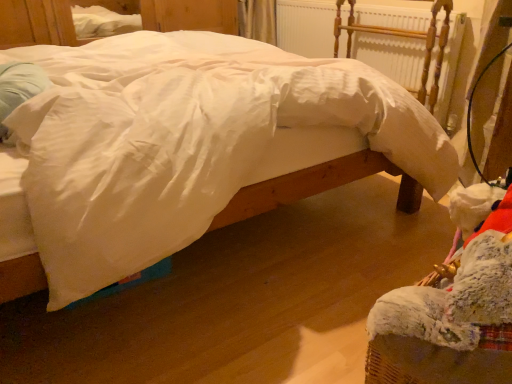
Where is `white painted wood radiator at upper center`? white painted wood radiator at upper center is located at coordinates (388, 41).

The height and width of the screenshot is (384, 512). I want to click on white smooth bed at center, so click(x=184, y=141).

Where is `white painted wood radiator at upper center`? white painted wood radiator at upper center is located at coordinates (388, 41).

At what (x,y) coordinates should I click in order to perform the action: click on radiator below the white smooth bed at center (from a real-world perspective). Please return your answer as a coordinate pair (x, y). Looking at the image, I should click on (388, 41).

Could you tell me if white smooth bed at center is facing white painted wood radiator at upper center?

Yes.

Considering the points (377, 91) and (370, 23), which point is in front, point (377, 91) or point (370, 23)?

The point (377, 91) is closer to the camera.

Does white smooth bed at center turn towards white soft pillow at left?

No, white smooth bed at center is not facing towards white soft pillow at left.

Is white smooth bed at center outside of white soft pillow at left?

Result: Indeed, white smooth bed at center is completely outside white soft pillow at left.

In the image, there is a white soft pillow at left. Identify the location of bed below it (from a real-world perspective). (184, 141).

Who is smaller, white smooth bed at center or white soft pillow at left?

Smaller between the two is white soft pillow at left.

From the image's perspective, is white soft pillow at left above or below white painted wood radiator at upper center?

From the image's perspective, white soft pillow at left appears below white painted wood radiator at upper center.

From a real-world perspective, does white soft pillow at left sit lower than white painted wood radiator at upper center?

No, from a real-world perspective, white soft pillow at left is not beneath white painted wood radiator at upper center.

Is white soft pillow at left facing away from white painted wood radiator at upper center?

No, white soft pillow at left is not facing the opposite direction of white painted wood radiator at upper center.

Is white painted wood radiator at upper center behind white smooth bed at center?

Yes, white painted wood radiator at upper center is further from the viewer.

Where is `radiator that is behind the white smooth bed at center`? Image resolution: width=512 pixels, height=384 pixels. radiator that is behind the white smooth bed at center is located at coordinates (388, 41).

From a real-world perspective, which is physically below, white painted wood radiator at upper center or white smooth bed at center?

In real-world perspective, white painted wood radiator at upper center is lower.

How many degrees apart are the facing directions of white painted wood radiator at upper center and white smooth bed at center?

179 degrees.

Considering the sizes of white painted wood radiator at upper center and white soft pillow at left in the image, is white painted wood radiator at upper center bigger or smaller than white soft pillow at left?

In the image, white painted wood radiator at upper center appears to be larger than white soft pillow at left.

Consider the image. From the image's perspective, between white painted wood radiator at upper center and white soft pillow at left, which one is located above?

white painted wood radiator at upper center, from the image's perspective.

From a real-world perspective, is white painted wood radiator at upper center positioned over white soft pillow at left based on gravity?

No, from a real-world perspective, white painted wood radiator at upper center is not on top of white soft pillow at left.

Is point (455, 46) more distant than point (11, 91)?

That is True.

Is white soft pillow at left with white smooth bed at center?

white soft pillow at left and white smooth bed at center are not in contact.

How many degrees apart are the facing directions of white soft pillow at left and white smooth bed at center?

There is a 1.56-degree angle between the facing directions of white soft pillow at left and white smooth bed at center.

In terms of width, does white soft pillow at left look wider or thinner when compared to white smooth bed at center?

In the image, white soft pillow at left appears to be more narrow than white smooth bed at center.

You are a GUI agent. You are given a task and a screenshot of the screen. Output one action in this format:
    pyautogui.click(x=<x>, y=<y>)
    Task: Click on the bed in front of the white painted wood radiator at upper center
    The height and width of the screenshot is (384, 512).
    Given the screenshot: What is the action you would take?
    pyautogui.click(x=184, y=141)

The width and height of the screenshot is (512, 384). Find the location of `bed located on the right of white soft pillow at left`. bed located on the right of white soft pillow at left is located at coordinates (184, 141).

Based on their spatial positions, is white soft pillow at left or white painted wood radiator at upper center closer to white smooth bed at center?

Among the two, white soft pillow at left is located nearer to white smooth bed at center.

Considering their positions, is white painted wood radiator at upper center positioned closer to white soft pillow at left than white smooth bed at center?

white smooth bed at center lies closer to white soft pillow at left than the other object.

From the picture: When comparing their distances from white painted wood radiator at upper center, does white smooth bed at center or white soft pillow at left seem further?

white soft pillow at left.

Based on the photo, considering their positions, is white soft pillow at left positioned closer to white painted wood radiator at upper center than white smooth bed at center?

white smooth bed at center.

Which object lies further to the anchor point white smooth bed at center, white painted wood radiator at upper center or white soft pillow at left?

white painted wood radiator at upper center is positioned further to the anchor white smooth bed at center.

Based on the photo, based on their spatial positions, is white smooth bed at center or white painted wood radiator at upper center further from white soft pillow at left?

The object further to white soft pillow at left is white painted wood radiator at upper center.

Image resolution: width=512 pixels, height=384 pixels. Identify the location of pillow between white smooth bed at center and white painted wood radiator at upper center from front to back. (18, 88).